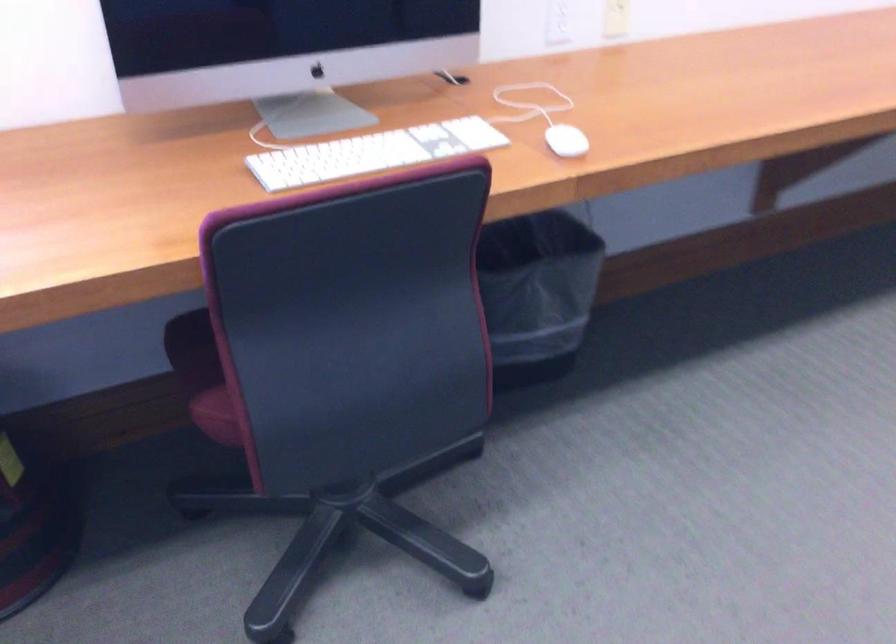
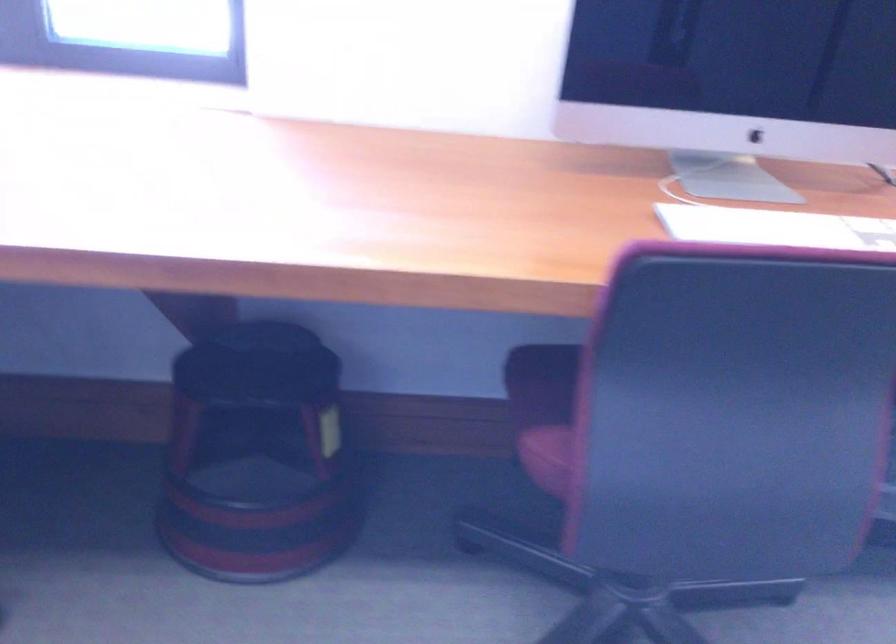
Question: How did the camera likely rotate?

Choices:
 (A) Left
 (B) Right
 (C) Up
 (D) Down

Answer: (A)